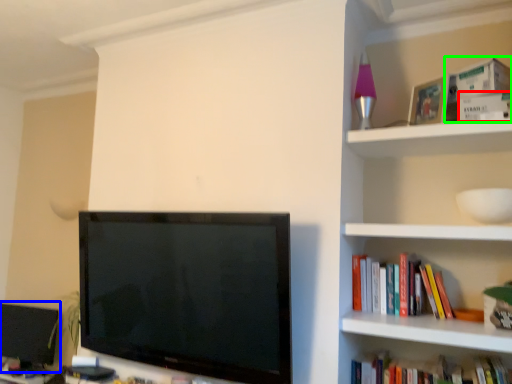
Question: Estimate the real-world distances between objects in this image. Which object is farther from paperback book (highlighted by a red box), computer monitor (highlighted by a blue box) or paperback book (highlighted by a green box)?

Choices:
 (A) computer monitor
 (B) paperback book

Answer: (A)